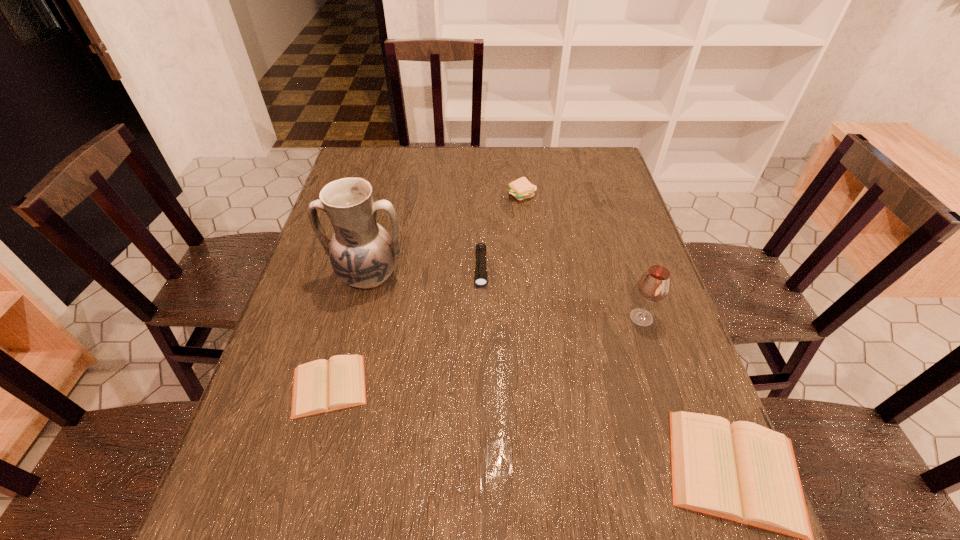
To achieve even spacing by inserting another diary among them, please point to a vacant spot for this new diary. Please provide its 2D coordinates. Your answer should be formatted as a tuple, i.e. [(x, y)], where the tuple contains the x and y coordinates of a point satisfying the conditions above.

[(517, 426)]